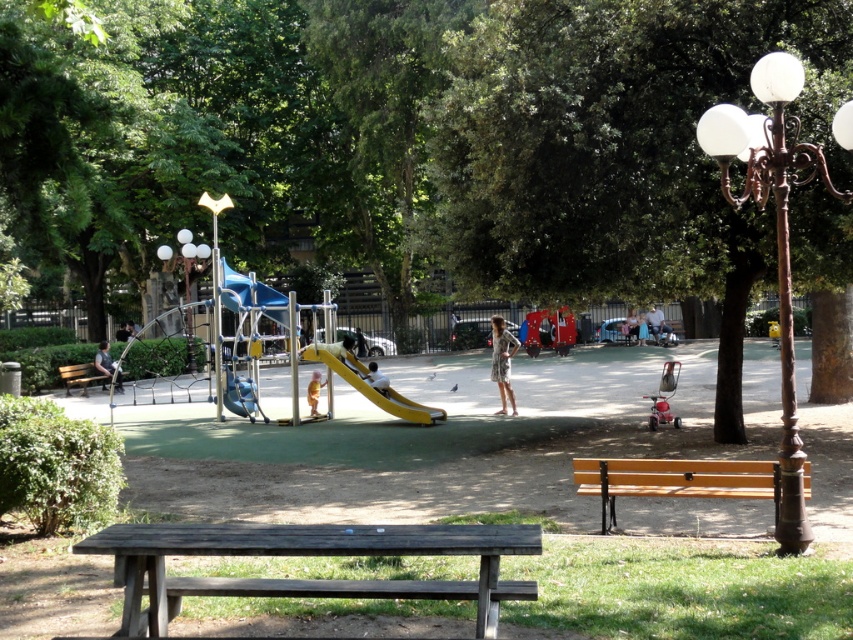
Question: Which of these objects is positioned farthest from the bronze wrought iron streetlight at right?

Choices:
 (A) wooden bench at left
 (B) light brown wooden bench at left
 (C) light blue denim jacket at center
 (D) light blue denim jeans at center

Answer: (B)

Question: Observing the image, what is the correct spatial positioning of dark brown wooden picnic table at lower center in reference to light blue denim jacket at center?

Choices:
 (A) below
 (B) above

Answer: (A)

Question: Which object appears closest to the camera in this image?

Choices:
 (A) light brown wooden bench at left
 (B) bronze wrought iron streetlight at right
 (C) light brown wooden slide at center

Answer: (B)

Question: Does green leafy tree at center come behind light brown wooden slide at center?

Choices:
 (A) yes
 (B) no

Answer: (B)

Question: Is light blue denim jacket at center positioned behind light blue denim dress at center?

Choices:
 (A) no
 (B) yes

Answer: (A)

Question: Estimate the real-world distances between objects in this image. Which object is closer to the wooden bench at center?

Choices:
 (A) light blue denim jeans at center
 (B) light brown wooden slide at center
 (C) dark gray fabric jacket at left

Answer: (B)